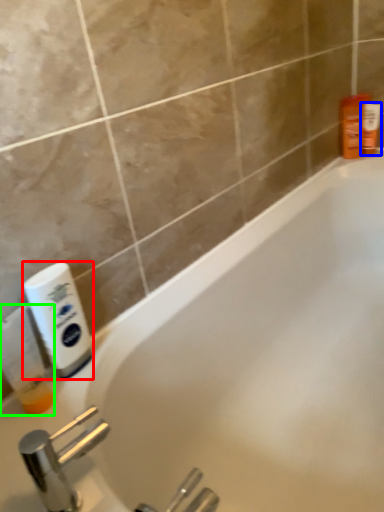
Question: Estimate the real-world distances between objects in this image. Which object is farther from cleaning product (highlighted by a red box), toiletry (highlighted by a blue box) or cleaning product (highlighted by a green box)?

Choices:
 (A) toiletry
 (B) cleaning product

Answer: (A)